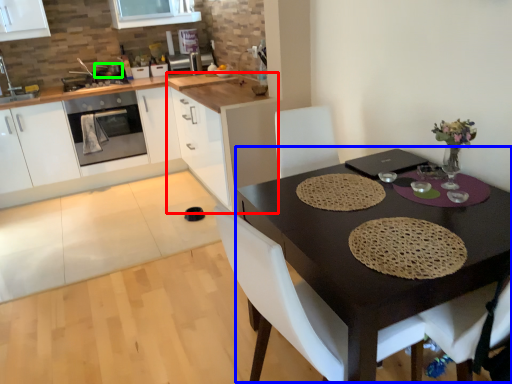
Question: Which is nearer to the cabinetry (highlighted by a red box)? round table (highlighted by a blue box) or appliance (highlighted by a green box).

Choices:
 (A) round table
 (B) appliance

Answer: (A)